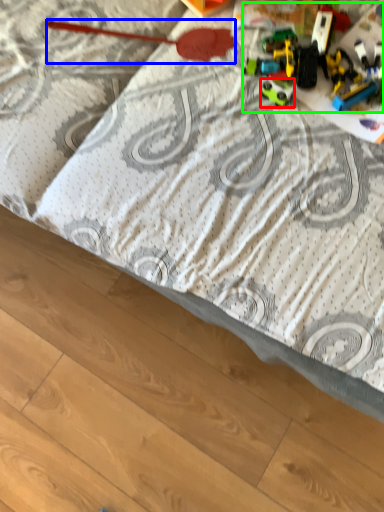
Question: Estimate the real-world distances between objects in this image. Which object is farther from toy (highlighted by a red box), toy (highlighted by a blue box) or toy (highlighted by a green box)?

Choices:
 (A) toy
 (B) toy

Answer: (A)